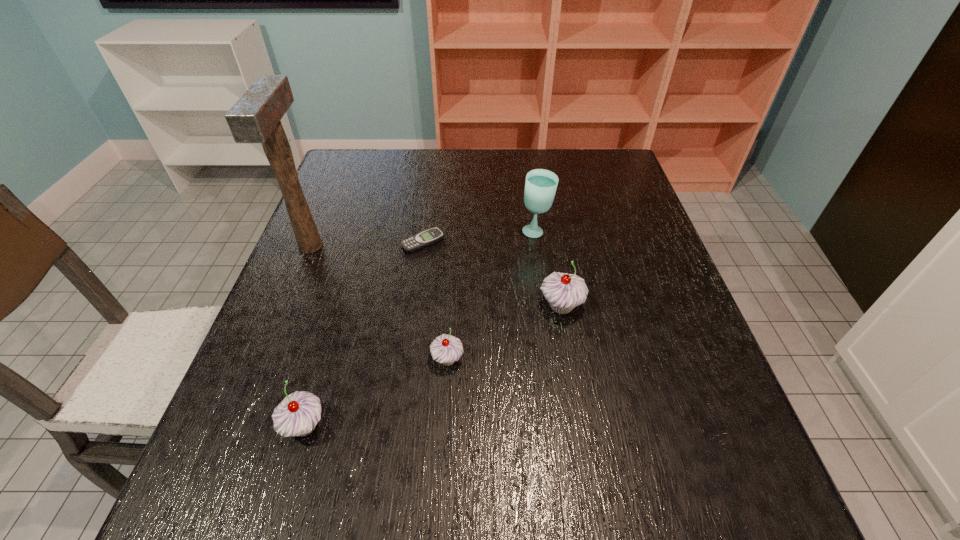
Locate an element on the screen. The image size is (960, 540). free space located on the back of the nearest object is located at coordinates (325, 355).

At what (x,y) coordinates should I click in order to perform the action: click on free region located 0.130m on the front of the second cupcake from right to left. Please return your answer as a coordinate pair (x, y). The height and width of the screenshot is (540, 960). Looking at the image, I should click on (443, 438).

Locate an element on the screen. The width and height of the screenshot is (960, 540). free space located on the front of the tallest cupcake is located at coordinates (569, 352).

At what (x,y) coordinates should I click in order to perform the action: click on vacant space located 0.310m on the front of the shortest object. Please return your answer as a coordinate pair (x, y). Looking at the image, I should click on (407, 357).

This screenshot has width=960, height=540. I want to click on free location located 0.160m on the right of the glass, so click(612, 232).

Identify the location of free space located on the front of the leftmost object. The width and height of the screenshot is (960, 540). (281, 318).

Locate an element on the screen. The width and height of the screenshot is (960, 540). object that is at the near edge is located at coordinates (297, 415).

The image size is (960, 540). Identify the location of cupcake located in the left edge section of the desktop. (297, 415).

The height and width of the screenshot is (540, 960). I want to click on mallet present at the left edge, so [x=255, y=118].

This screenshot has height=540, width=960. What are the coordinates of `object located at the near left corner` in the screenshot? It's located at (297, 415).